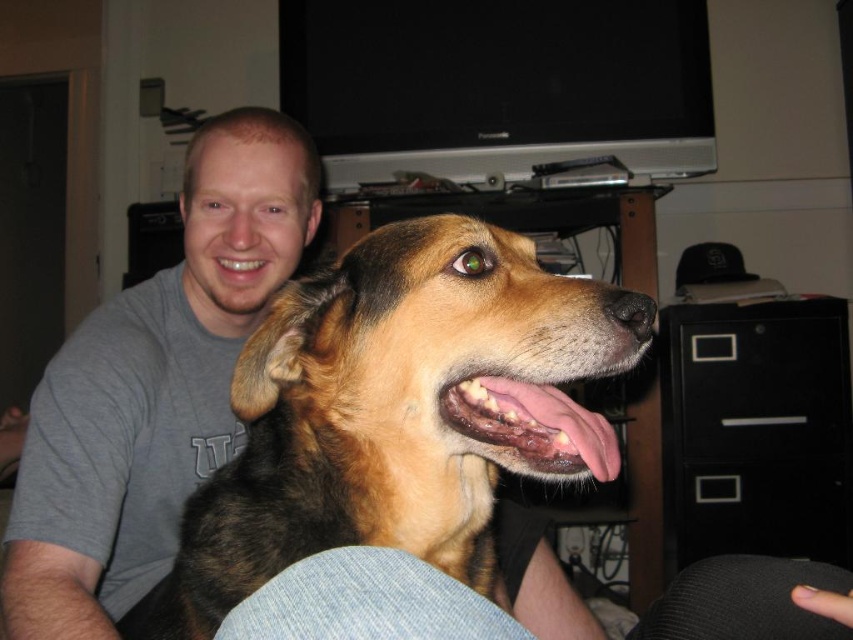
Can you confirm if gray cotton shirt at upper left is smaller than pink flesh at center?

Actually, gray cotton shirt at upper left might be larger than pink flesh at center.

Does gray cotton shirt at upper left come behind pink flesh at center?

Yes, it is behind pink flesh at center.

Based on the photo, who is more distant from viewer, (105,596) or (456,422)?

Positioned behind is point (105,596).

This screenshot has height=640, width=853. In order to click on gray cotton shirt at upper left in this screenshot , I will do `click(151, 388)`.

Does black plastic/file cabinet at right appear under pink flesh at center?

Correct, black plastic/file cabinet at right is located below pink flesh at center.

Between point (798, 394) and point (544, 396), which one is positioned behind?

Positioned behind is point (798, 394).

You are a GUI agent. You are given a task and a screenshot of the screen. Output one action in this format:
    pyautogui.click(x=<x>, y=<y>)
    Task: Click on the black plastic/file cabinet at right
    The height and width of the screenshot is (640, 853).
    Given the screenshot: What is the action you would take?
    pyautogui.click(x=755, y=429)

What do you see at coordinates (398, 412) in the screenshot? I see `brown fur dog at center` at bounding box center [398, 412].

Where is `brown fur dog at center`? Image resolution: width=853 pixels, height=640 pixels. brown fur dog at center is located at coordinates (398, 412).